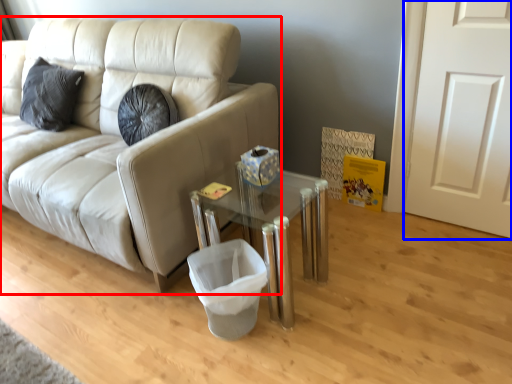
Question: Which point is closer to the camera, studio couch (highlighted by a red box) or door (highlighted by a blue box)?

Choices:
 (A) studio couch
 (B) door

Answer: (A)